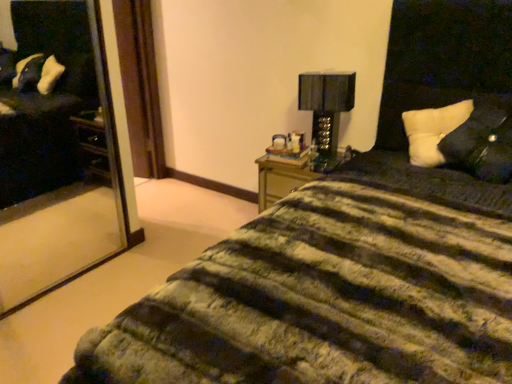
Locate an element on the screen. Image resolution: width=512 pixels, height=384 pixels. white soft pillow at right, which appears as the 1th pillow when viewed from the front is located at coordinates (482, 140).

What is the approximate height of white soft pillow at upper right, which is the second pillow from front to back?

It is 13.84 inches.

The image size is (512, 384). In order to click on white soft pillow at right, placed as the 2th pillow when sorted from back to front in this screenshot , I will do `click(482, 140)`.

Identify the location of pillow in front of the white soft pillow at upper right, the first pillow when ordered from back to front. (482, 140).

From the image's perspective, which object appears higher, white soft pillow at upper right, the first pillow when ordered from back to front, or white soft pillow at right, which appears as the 1th pillow when viewed from the front?

white soft pillow at upper right, the first pillow when ordered from back to front.

From the picture: Is white soft pillow at upper right, which is the second pillow from front to back, positioned with its back to white soft pillow at right, which appears as the 1th pillow when viewed from the front?

Yes.

From a real-world perspective, is white soft pillow at right, placed as the 2th pillow when sorted from back to front, under white soft pillow at upper right, which is the second pillow from front to back?

No, from a real-world perspective, white soft pillow at right, placed as the 2th pillow when sorted from back to front, is not below white soft pillow at upper right, which is the second pillow from front to back.

Which object is positioned more to the right, white soft pillow at right, which appears as the 1th pillow when viewed from the front, or white soft pillow at upper right, which is the second pillow from front to back?

white soft pillow at right, which appears as the 1th pillow when viewed from the front.

I want to click on pillow lying above the white soft pillow at right, placed as the 2th pillow when sorted from back to front (from the image's perspective), so coord(432,131).

Considering the relative sizes of white soft pillow at right, which appears as the 1th pillow when viewed from the front, and white soft pillow at upper right, which is the second pillow from front to back, in the image provided, is white soft pillow at right, which appears as the 1th pillow when viewed from the front, thinner than white soft pillow at upper right, which is the second pillow from front to back,?

No, white soft pillow at right, which appears as the 1th pillow when viewed from the front, is not thinner than white soft pillow at upper right, which is the second pillow from front to back.

In the scene shown: From a real-world perspective, is white soft pillow at upper right, which is the second pillow from front to back, positioned under black glossy table lamp at upper right based on gravity?

No.

Based on the photo, which point is more distant from viewer, [445,110] or [301,108]?

The point [301,108] is farther.

Could you tell me if white soft pillow at upper right, the first pillow when ordered from back to front, is turned towards black glossy table lamp at upper right?

No, white soft pillow at upper right, the first pillow when ordered from back to front, is not aimed at black glossy table lamp at upper right.

From the image's perspective, who appears lower, black glossy table lamp at upper right or white soft pillow at right, which appears as the 1th pillow when viewed from the front?

white soft pillow at right, which appears as the 1th pillow when viewed from the front, from the image's perspective.

Looking at their sizes, would you say black glossy table lamp at upper right is wider or thinner than white soft pillow at right, which appears as the 1th pillow when viewed from the front?

Clearly, black glossy table lamp at upper right has less width compared to white soft pillow at right, which appears as the 1th pillow when viewed from the front.

Is the position of black glossy table lamp at upper right less distant than that of white soft pillow at right, which appears as the 1th pillow when viewed from the front?

No, black glossy table lamp at upper right is behind white soft pillow at right, which appears as the 1th pillow when viewed from the front.

Is black glossy table lamp at upper right bigger or smaller than white soft pillow at right, placed as the 2th pillow when sorted from back to front?

In the image, black glossy table lamp at upper right appears to be smaller than white soft pillow at right, placed as the 2th pillow when sorted from back to front.

Considering the sizes of objects white soft pillow at right, which appears as the 1th pillow when viewed from the front, and black glossy table lamp at upper right in the image provided, who is smaller, white soft pillow at right, which appears as the 1th pillow when viewed from the front, or black glossy table lamp at upper right?

With smaller size is black glossy table lamp at upper right.

From a real-world perspective, which is physically above, white soft pillow at right, placed as the 2th pillow when sorted from back to front, or black glossy table lamp at upper right?

white soft pillow at right, placed as the 2th pillow when sorted from back to front.

Looking at this image, is white soft pillow at right, placed as the 2th pillow when sorted from back to front, oriented towards black glossy table lamp at upper right?

No, white soft pillow at right, placed as the 2th pillow when sorted from back to front, is not aimed at black glossy table lamp at upper right.

Is white soft pillow at right, placed as the 2th pillow when sorted from back to front, next to black glossy table lamp at upper right and touching it?

white soft pillow at right, placed as the 2th pillow when sorted from back to front, and black glossy table lamp at upper right are clearly separated.

Can you confirm if black glossy table lamp at upper right is smaller than white soft pillow at upper right, the first pillow when ordered from back to front?

Correct, black glossy table lamp at upper right occupies less space than white soft pillow at upper right, the first pillow when ordered from back to front.

Considering the relative sizes of black glossy table lamp at upper right and white soft pillow at upper right, the first pillow when ordered from back to front, in the image provided, is black glossy table lamp at upper right wider than white soft pillow at upper right, the first pillow when ordered from back to front,?

In fact, black glossy table lamp at upper right might be narrower than white soft pillow at upper right, the first pillow when ordered from back to front.

From a real-world perspective, which object stands above the other?

In real-world perspective, white soft pillow at upper right, the first pillow when ordered from back to front, is above.

From the image's perspective, is black glossy table lamp at upper right located above white soft pillow at upper right, which is the second pillow from front to back?

Indeed, from the image's perspective, black glossy table lamp at upper right is shown above white soft pillow at upper right, which is the second pillow from front to back.

The image size is (512, 384). In order to click on pillow below the white soft pillow at upper right, which is the second pillow from front to back (from the image's perspective) in this screenshot , I will do `click(482, 140)`.

Where is `pillow above the white soft pillow at upper right, the first pillow when ordered from back to front (from a real-world perspective)`? Image resolution: width=512 pixels, height=384 pixels. pillow above the white soft pillow at upper right, the first pillow when ordered from back to front (from a real-world perspective) is located at coordinates (482, 140).

Considering their positions, is black glossy table lamp at upper right positioned further to white soft pillow at right, which appears as the 1th pillow when viewed from the front, than white soft pillow at upper right, the first pillow when ordered from back to front?

black glossy table lamp at upper right.

Estimate the real-world distances between objects in this image. Which object is closer to white soft pillow at upper right, the first pillow when ordered from back to front, white soft pillow at right, which appears as the 1th pillow when viewed from the front, or black glossy table lamp at upper right?

white soft pillow at right, which appears as the 1th pillow when viewed from the front.

Based on their spatial positions, is white soft pillow at upper right, which is the second pillow from front to back, or white soft pillow at right, placed as the 2th pillow when sorted from back to front, closer to black glossy table lamp at upper right?

Based on the image, white soft pillow at upper right, which is the second pillow from front to back, appears to be nearer to black glossy table lamp at upper right.

When comparing their distances from black glossy table lamp at upper right, does white soft pillow at right, which appears as the 1th pillow when viewed from the front, or white soft pillow at upper right, which is the second pillow from front to back, seem further?

white soft pillow at right, which appears as the 1th pillow when viewed from the front, is further to black glossy table lamp at upper right.

Estimate the real-world distances between objects in this image. Which object is closer to white soft pillow at right, which appears as the 1th pillow when viewed from the front, white soft pillow at upper right, the first pillow when ordered from back to front, or black glossy table lamp at upper right?

The object closer to white soft pillow at right, which appears as the 1th pillow when viewed from the front, is white soft pillow at upper right, the first pillow when ordered from back to front.

When comparing their distances from white soft pillow at upper right, which is the second pillow from front to back, does black glossy table lamp at upper right or white soft pillow at right, which appears as the 1th pillow when viewed from the front, seem further?

Based on the image, black glossy table lamp at upper right appears to be further to white soft pillow at upper right, which is the second pillow from front to back.

Identify the location of pillow between white soft pillow at right, placed as the 2th pillow when sorted from back to front, and black glossy table lamp at upper right from front to back. The width and height of the screenshot is (512, 384). (432, 131).